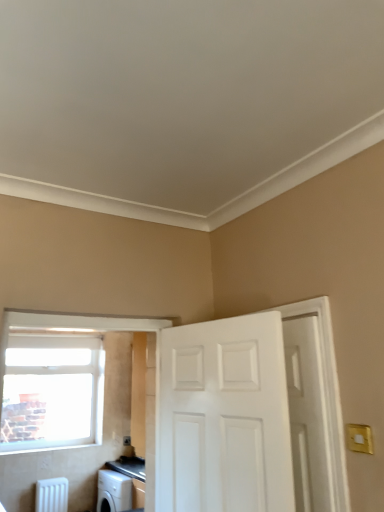
Question: Is white glossy door at center, the second door in the right-to-left sequence, far away from clear glass window at upper left?

Choices:
 (A) no
 (B) yes

Answer: (B)

Question: Is white glossy door at center, marked as the 1th door in a left-to-right arrangement, to the left of clear glass window at upper left from the viewer's perspective?

Choices:
 (A) yes
 (B) no

Answer: (B)

Question: From the image's perspective, is white glossy door at center, the second door in the right-to-left sequence, located beneath clear glass window at upper left?

Choices:
 (A) yes
 (B) no

Answer: (B)

Question: Is white glossy door at center, the second door in the right-to-left sequence, behind clear glass window at upper left?

Choices:
 (A) no
 (B) yes

Answer: (A)

Question: From the image's perspective, is white glossy door at center, marked as the 1th door in a left-to-right arrangement, located above clear glass window at upper left?

Choices:
 (A) yes
 (B) no

Answer: (A)

Question: Is white matte door at right, the 1th door in the right-to-left sequence, in front of or behind white plastic radiator at lower left in the image?

Choices:
 (A) behind
 (B) front

Answer: (B)

Question: In terms of height, does white matte door at right, the 1th door in the right-to-left sequence, look taller or shorter compared to white plastic radiator at lower left?

Choices:
 (A) tall
 (B) short

Answer: (A)

Question: Considering the positions of point (296, 450) and point (39, 480), is point (296, 450) closer or farther from the camera than point (39, 480)?

Choices:
 (A) farther
 (B) closer

Answer: (B)

Question: Is white matte door at right, placed as the second door when sorted from left to right, situated inside white plastic radiator at lower left or outside?

Choices:
 (A) inside
 (B) outside

Answer: (B)

Question: From a real-world perspective, is clear glass window at upper left positioned above or below white plastic radiator at lower left?

Choices:
 (A) above
 (B) below

Answer: (A)

Question: Considering the positions of clear glass window at upper left and white plastic radiator at lower left in the image, is clear glass window at upper left wider or thinner than white plastic radiator at lower left?

Choices:
 (A) thin
 (B) wide

Answer: (A)

Question: From their relative heights in the image, would you say clear glass window at upper left is taller or shorter than white plastic radiator at lower left?

Choices:
 (A) short
 (B) tall

Answer: (B)

Question: Does point (23, 446) appear closer or farther from the camera than point (39, 500)?

Choices:
 (A) farther
 (B) closer

Answer: (B)

Question: From their relative heights in the image, would you say white glossy door at center, the second door in the right-to-left sequence, is taller or shorter than white plastic radiator at lower left?

Choices:
 (A) tall
 (B) short

Answer: (A)

Question: Is white glossy door at center, the second door in the right-to-left sequence, inside the boundaries of white plastic radiator at lower left, or outside?

Choices:
 (A) inside
 (B) outside

Answer: (B)